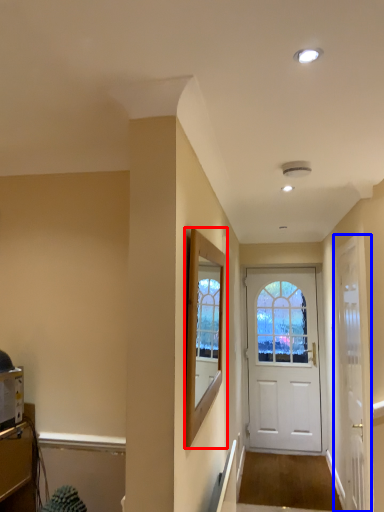
Question: Which object is further to the camera taking this photo, window screen (highlighted by a red box) or door (highlighted by a blue box)?

Choices:
 (A) window screen
 (B) door

Answer: (B)